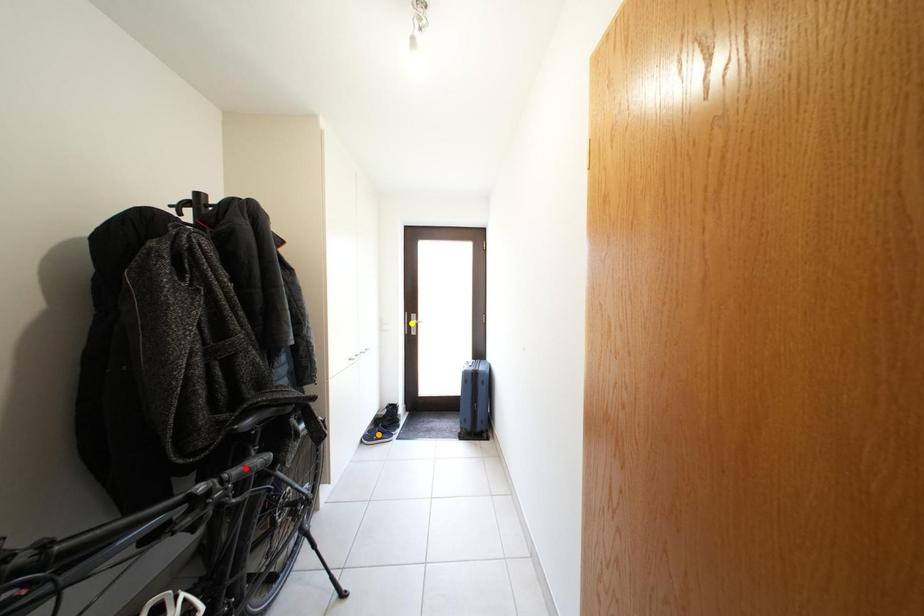
Order these from nearest to farthest:
red point | yellow point | orange point

1. yellow point
2. orange point
3. red point